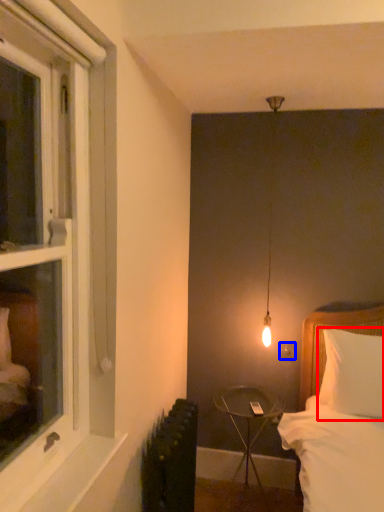
Question: Which of the following is the farthest to the observer, pillow (highlighted by a red box) or electric outlet (highlighted by a blue box)?

Choices:
 (A) pillow
 (B) electric outlet

Answer: (B)